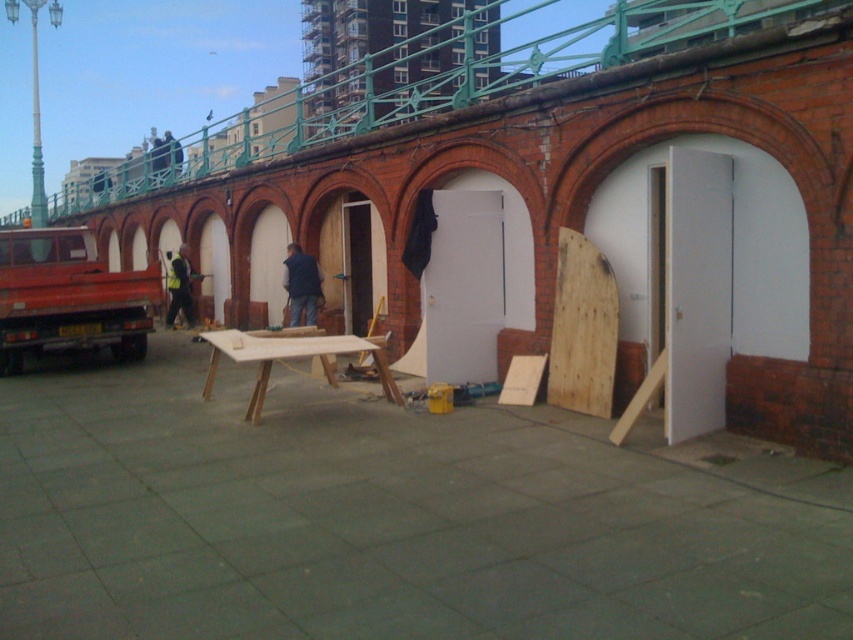
Question: Which of the following is the closest to the observer?

Choices:
 (A) (567, 253)
 (B) (440, 202)

Answer: (A)

Question: Estimate the real-world distances between objects in this image. Which object is farther from the reflective yellow safety vest at center?

Choices:
 (A) dark blue jacket at center
 (B) white matte door at center
 (C) wooden at center

Answer: (C)

Question: Does white matte door at center have a lesser width compared to reflective yellow safety vest at center?

Choices:
 (A) yes
 (B) no

Answer: (B)

Question: Does wooden at center have a smaller size compared to dark blue jacket at center?

Choices:
 (A) yes
 (B) no

Answer: (B)

Question: Does white matte door at center have a smaller size compared to matte red truck at left?

Choices:
 (A) yes
 (B) no

Answer: (B)

Question: Considering the real-world distances, which object is farthest from the matte red truck at left?

Choices:
 (A) white matte door at center
 (B) reflective yellow safety vest at center

Answer: (A)